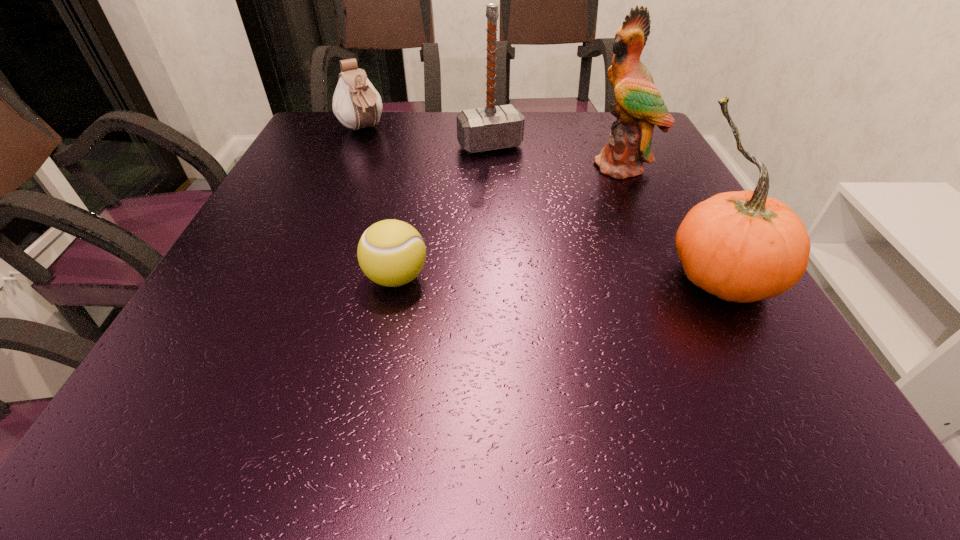
Locate an element on the screen. This screenshot has height=540, width=960. free spot at the near left corner of the desktop is located at coordinates (212, 332).

In the image, there is a desktop. At what (x,y) coordinates should I click in order to perform the action: click on blank space at the far right corner. Please return your answer as a coordinate pair (x, y). The height and width of the screenshot is (540, 960). Looking at the image, I should click on (614, 122).

Where is `free space that is in between the parrot and the pumpkin`? This screenshot has width=960, height=540. free space that is in between the parrot and the pumpkin is located at coordinates (672, 221).

At what (x,y) coordinates should I click in order to perform the action: click on free point between the third object from right to left and the second object from left to right. Please return your answer as a coordinate pair (x, y). Looking at the image, I should click on (444, 212).

This screenshot has width=960, height=540. What are the coordinates of `vacant space in between the pumpkin and the tennis ball` in the screenshot? It's located at (559, 278).

You are a GUI agent. You are given a task and a screenshot of the screen. Output one action in this format:
    pyautogui.click(x=<x>, y=<y>)
    Task: Click on the vacant point located between the pouch and the shortest object
    
    Given the screenshot: What is the action you would take?
    pyautogui.click(x=379, y=204)

Where is `vacant space in between the parrot and the third object from left to right`? The height and width of the screenshot is (540, 960). vacant space in between the parrot and the third object from left to right is located at coordinates (557, 156).

The image size is (960, 540). What are the coordinates of `empty space between the pouch and the pumpkin` in the screenshot? It's located at (541, 204).

I want to click on free space between the hammer and the second shortest object, so click(425, 138).

You are a GUI agent. You are given a task and a screenshot of the screen. Output one action in this format:
    pyautogui.click(x=<x>, y=<y>)
    Task: Click on the blank region between the pumpkin and the parrot
    This screenshot has height=540, width=960.
    Given the screenshot: What is the action you would take?
    pyautogui.click(x=672, y=221)